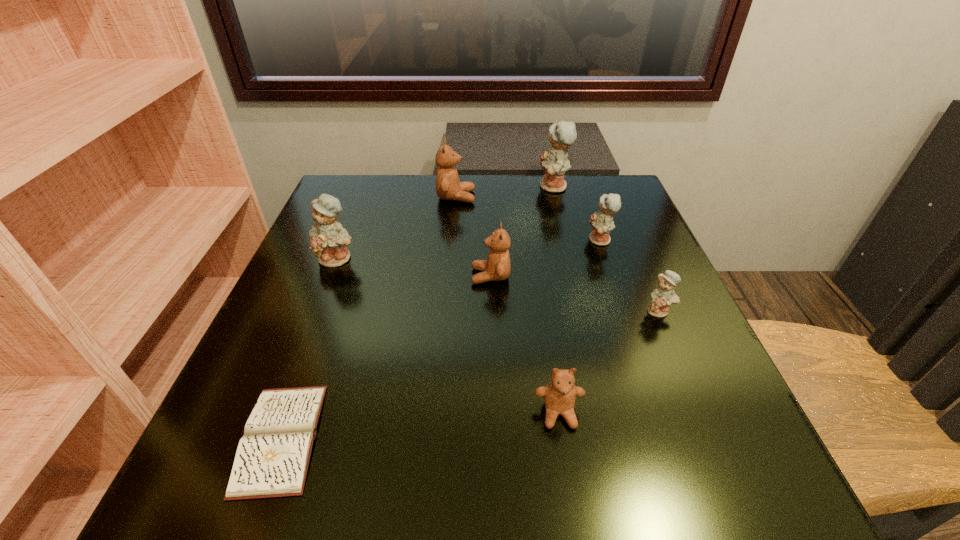
Locate an element on the screen. the farthest blue teddy bear is located at coordinates (555, 163).

Where is `the second blue teddy bear from left to right`? the second blue teddy bear from left to right is located at coordinates (555, 163).

The height and width of the screenshot is (540, 960). I want to click on the farthest brown teddy bear, so click(x=448, y=186).

Where is `the leftmost blue teddy bear`? the leftmost blue teddy bear is located at coordinates (328, 239).

This screenshot has height=540, width=960. I want to click on the second biggest blue teddy bear, so click(328, 239).

At what (x,y) coordinates should I click in order to perform the action: click on the sixth teddy bear from left to right. Please return your answer as a coordinate pair (x, y). This screenshot has height=540, width=960. Looking at the image, I should click on (602, 223).

This screenshot has height=540, width=960. I want to click on the third biggest blue teddy bear, so click(x=602, y=223).

The image size is (960, 540). Identify the location of the second biggest brown teddy bear. (497, 267).

You are a GUI agent. You are given a task and a screenshot of the screen. Output one action in this format:
    pyautogui.click(x=<x>, y=<y>)
    Task: Click on the third nearest object
    The width and height of the screenshot is (960, 540).
    Given the screenshot: What is the action you would take?
    pyautogui.click(x=664, y=295)

The image size is (960, 540). Identify the location of the rightmost object. (664, 295).